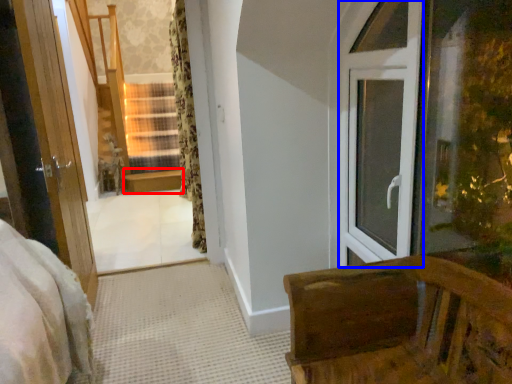
Question: Which of the following is the closest to the observer, window sill (highlighted by a red box) or window frame (highlighted by a blue box)?

Choices:
 (A) window sill
 (B) window frame

Answer: (B)